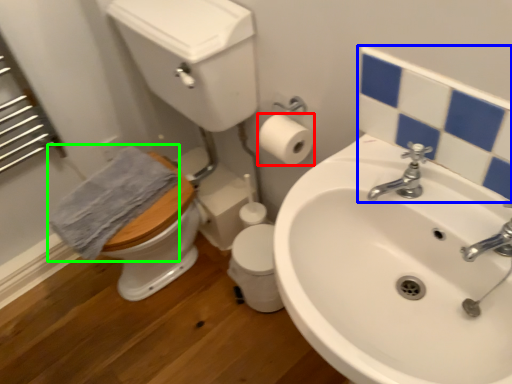
Question: Considering the real-world distances, which object is farthest from toilet paper (highlighted by a red box)? mirror (highlighted by a blue box) or bath towel (highlighted by a green box)?

Choices:
 (A) mirror
 (B) bath towel

Answer: (B)